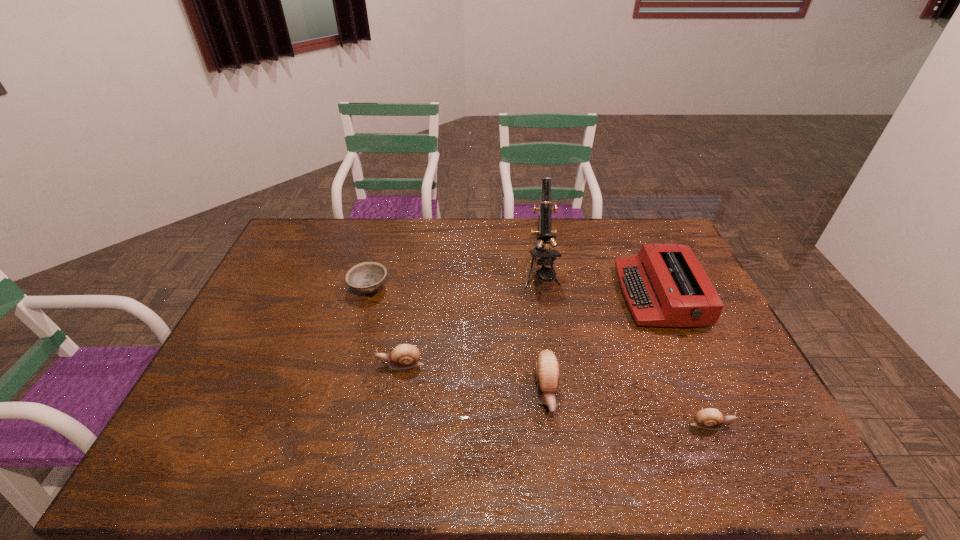
Find the location of a particular element. The height and width of the screenshot is (540, 960). unoccupied area between the rightmost escargot and the tallest escargot is located at coordinates (629, 409).

You are a GUI agent. You are given a task and a screenshot of the screen. Output one action in this format:
    pyautogui.click(x=<x>, y=<y>)
    Task: Click on the blank region between the shortest escargot and the typewriter
    This screenshot has height=540, width=960.
    Given the screenshot: What is the action you would take?
    pyautogui.click(x=685, y=360)

Image resolution: width=960 pixels, height=540 pixels. I want to click on free spot between the second escargot from left to right and the shortest escargot, so click(629, 409).

Where is `vacant area that lies between the typewriter and the tallest escargot`? The image size is (960, 540). vacant area that lies between the typewriter and the tallest escargot is located at coordinates (603, 344).

Choose which object is the third nearest neighbor to the tallest escargot. Please provide its 2D coordinates. Your answer should be formatted as a tuple, i.e. [(x, y)], where the tuple contains the x and y coordinates of a point satisfying the conditions above.

[(403, 356)]

Where is `object identified as the second closest to the typewriter`? The image size is (960, 540). object identified as the second closest to the typewriter is located at coordinates (547, 369).

Image resolution: width=960 pixels, height=540 pixels. I want to click on the closest escargot to the leftmost escargot, so click(x=547, y=369).

Choose which escargot is the nearest neighbor to the second object from left to right. Please provide its 2D coordinates. Your answer should be formatted as a tuple, i.e. [(x, y)], where the tuple contains the x and y coordinates of a point satisfying the conditions above.

[(547, 369)]

Locate an element on the screen. Image resolution: width=960 pixels, height=540 pixels. free location that satisfies the following two spatial constraints: 1. on the typing side of the typewriter; 2. on the front-facing side of the second escargot from right to left is located at coordinates (703, 393).

Identify the location of vacant space that satisfies the following two spatial constraints: 1. on the typing side of the typewriter; 2. on the front-facing side of the tallest escargot. The image size is (960, 540). (703, 393).